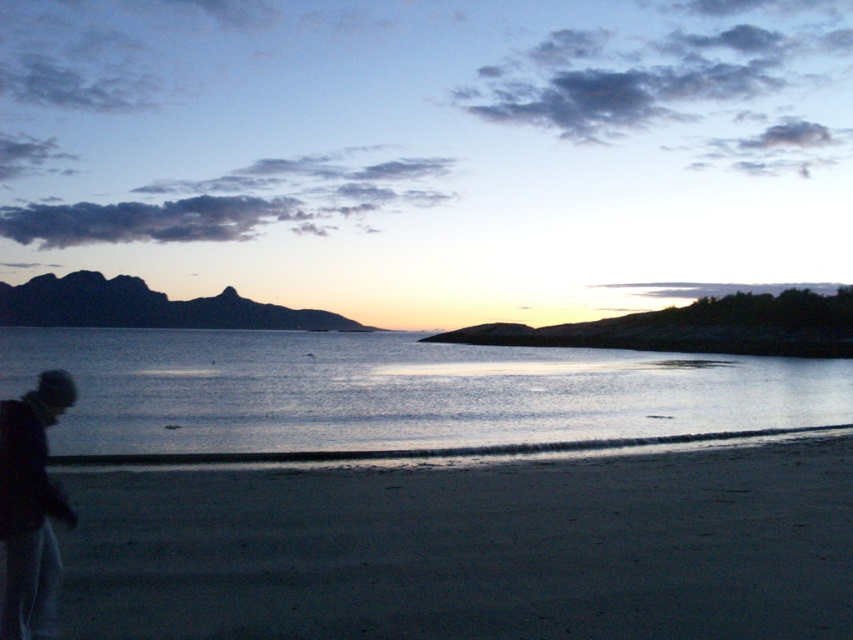
Is dark sand at lower left wider than dark gray woolen hat at lower left?

Yes, dark sand at lower left is wider than dark gray woolen hat at lower left.

Can you confirm if dark sand at lower left is positioned above dark gray woolen hat at lower left?

No.

Who is more distant from viewer, [639,593] or [53,605]?

The point [639,593] is behind.

Find the location of a particular element. dark sand at lower left is located at coordinates (469, 547).

Is glistening water at center in front of dark gray woolen hat at lower left?

No.

Does glistening water at center have a smaller size compared to dark gray woolen hat at lower left?

Actually, glistening water at center might be larger than dark gray woolen hat at lower left.

Is point (68, 436) behind point (39, 428)?

That is True.

This screenshot has height=640, width=853. In order to click on glistening water at center in this screenshot , I will do `click(398, 392)`.

How much distance is there between dark sand at lower left and glistening water at center?

They are 92.54 feet apart.

Is dark sand at lower left above glistening water at center?

Actually, dark sand at lower left is below glistening water at center.

The image size is (853, 640). What are the coordinates of `dark sand at lower left` in the screenshot? It's located at (469, 547).

You are a GUI agent. You are given a task and a screenshot of the screen. Output one action in this format:
    pyautogui.click(x=<x>, y=<y>)
    Task: Click on the dark sand at lower left
    
    Given the screenshot: What is the action you would take?
    pyautogui.click(x=469, y=547)